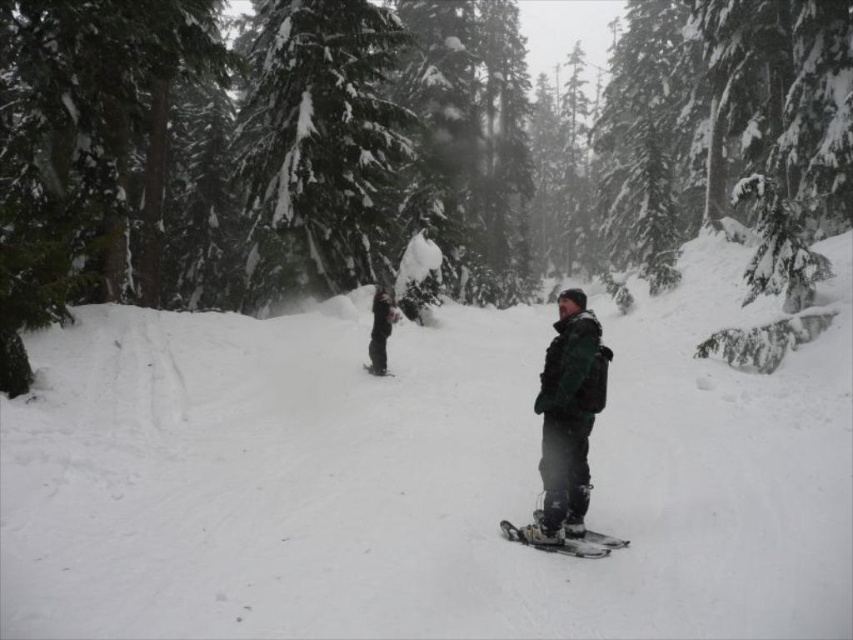
Question: Which point is closer to the camera?

Choices:
 (A) white fluffy snow at center
 (B) black matte snowboard at center

Answer: (A)

Question: Does snow-covered evergreen tree at center have a larger size compared to green matte snowboarder at center?

Choices:
 (A) no
 (B) yes

Answer: (B)

Question: Among these points, which one is nearest to the camera?

Choices:
 (A) (749, 24)
 (B) (375, 369)
 (C) (573, 547)

Answer: (C)

Question: Which object is closer to the camera taking this photo?

Choices:
 (A) shiny black snowboard at center
 (B) snow-covered evergreen tree at center
 (C) white fluffy snow at center
 (D) green matte snowboarder at center

Answer: (C)

Question: Is white fluffy snow at center positioned at the back of shiny black snowboard at center?

Choices:
 (A) yes
 (B) no

Answer: (B)

Question: Is the position of snow-covered evergreen at center less distant than that of black matte snowboard at center?

Choices:
 (A) yes
 (B) no

Answer: (B)